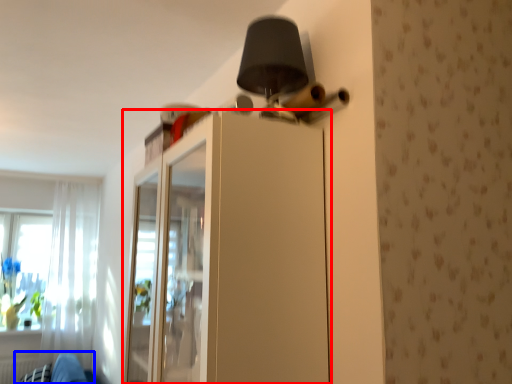
Question: Which object is closer to the camera taking this photo, dresser (highlighted by a red box) or swivel chair (highlighted by a blue box)?

Choices:
 (A) dresser
 (B) swivel chair

Answer: (A)